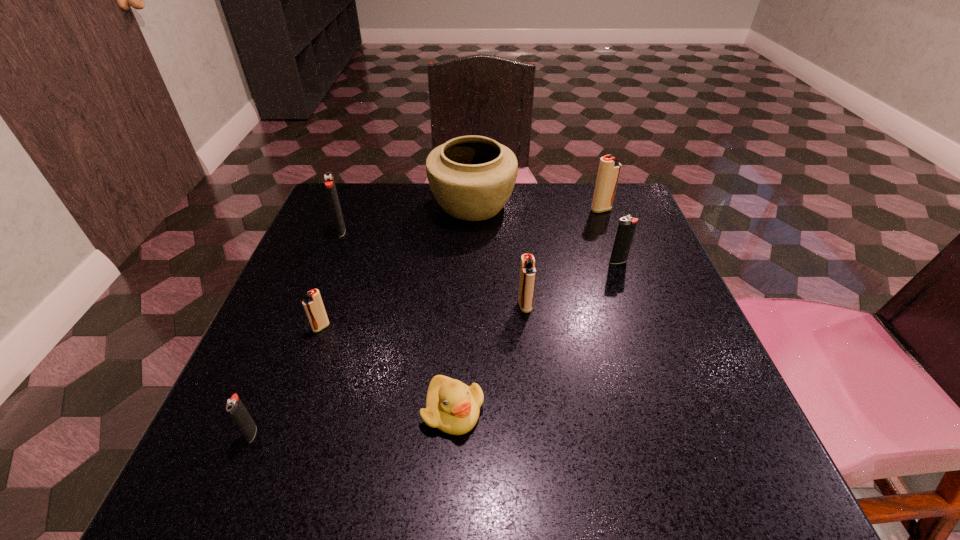
In order to click on vacant space at the left edge of the desktop in this screenshot , I will do `click(286, 288)`.

Where is `free region at the right edge of the desktop`? free region at the right edge of the desktop is located at coordinates (676, 291).

In order to click on free point at the far left corner in this screenshot , I will do `click(363, 197)`.

You are a GUI agent. You are given a task and a screenshot of the screen. Output one action in this format:
    pyautogui.click(x=<x>, y=<y>)
    Task: Click on the vacant space at the far right corner of the desktop
    The image size is (960, 540).
    Given the screenshot: What is the action you would take?
    pyautogui.click(x=588, y=213)

What are the coordinates of `free space between the fourth farthest object and the second nearest igniter` in the screenshot? It's located at (469, 294).

At what (x,y) coordinates should I click in order to perform the action: click on vacant space that's between the smallest black igniter and the third farthest igniter. Please return your answer as a coordinate pair (x, y). The image size is (960, 540). Looking at the image, I should click on coord(435,347).

Where is `vacant point located between the second farthest igniter and the third nearest igniter`? Image resolution: width=960 pixels, height=540 pixels. vacant point located between the second farthest igniter and the third nearest igniter is located at coordinates (433, 268).

I want to click on free space between the third igniter from left to right and the nearest igniter, so coord(287,380).

Find the location of a particular element. vacant space that's between the second smallest black igniter and the shortest object is located at coordinates (536, 336).

Image resolution: width=960 pixels, height=540 pixels. I want to click on vacant area that lies between the rightmost black igniter and the second farthest igniter, so click(x=480, y=246).